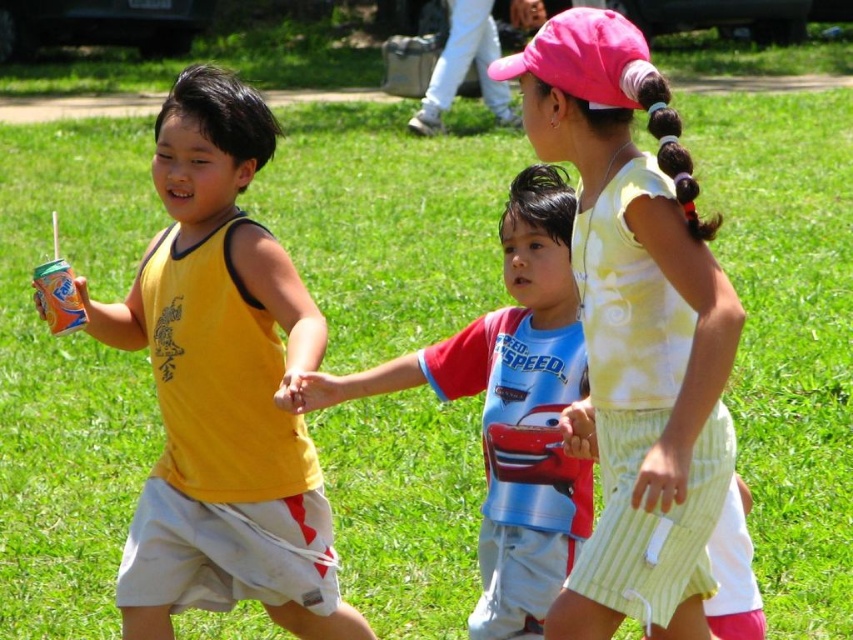
From the picture: Which is above, light yellow tie-dye shirt at center or red and blue cotton shirt at center?

light yellow tie-dye shirt at center is higher up.

Looking at this image, which is more to the left, light yellow tie-dye shirt at center or red and blue cotton shirt at center?

red and blue cotton shirt at center

Image resolution: width=853 pixels, height=640 pixels. I want to click on light yellow tie-dye shirt at center, so click(x=636, y=328).

Can you confirm if yellow sleeveless shirt at left is bigger than red and blue cotton shirt at center?

Yes.

Between point (184, 326) and point (485, 348), which one is positioned behind?

Point (485, 348)

At what (x,y) coordinates should I click in order to perform the action: click on yellow sleeveless shirt at left. Please return your answer as a coordinate pair (x, y). Image resolution: width=853 pixels, height=640 pixels. Looking at the image, I should click on (222, 387).

The height and width of the screenshot is (640, 853). I want to click on yellow sleeveless shirt at left, so click(222, 387).

Is yellow sleeveless shirt at left to the left of light yellow tie-dye shirt at center from the viewer's perspective?

Indeed, yellow sleeveless shirt at left is positioned on the left side of light yellow tie-dye shirt at center.

Locate an element on the screen. The height and width of the screenshot is (640, 853). yellow sleeveless shirt at left is located at coordinates (222, 387).

The height and width of the screenshot is (640, 853). Find the location of `yellow sleeveless shirt at left`. yellow sleeveless shirt at left is located at coordinates (222, 387).